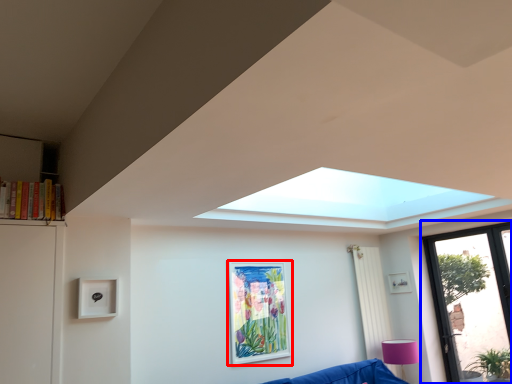
Question: Which object is closer to the camera taking this photo, picture frame (highlighted by a red box) or window (highlighted by a blue box)?

Choices:
 (A) picture frame
 (B) window

Answer: (A)